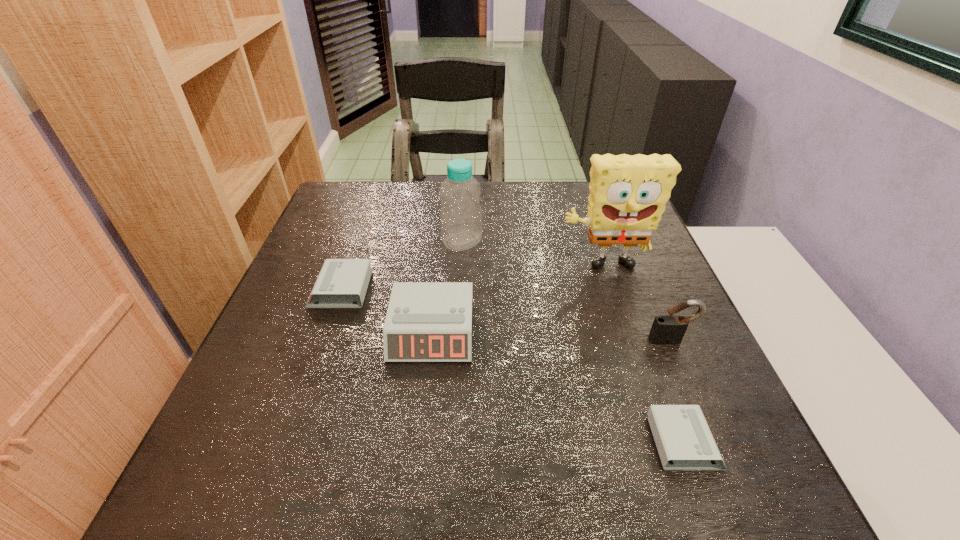
Identify which object is the nearest to the bottle. Please provide its 2D coordinates. Your answer should be formatted as a tuple, i.e. [(x, y)], where the tuple contains the x and y coordinates of a point satisfying the conditions above.

[(341, 282)]

Where is `the second closest alarm clock to the third tallest object`? This screenshot has width=960, height=540. the second closest alarm clock to the third tallest object is located at coordinates (426, 321).

This screenshot has width=960, height=540. I want to click on alarm clock that stands as the closest to the bottle, so click(x=341, y=282).

Where is `free space that satisfies the following two spatial constraints: 1. on the face of the sponge; 2. on the right side of the nearest alarm clock`? This screenshot has height=540, width=960. free space that satisfies the following two spatial constraints: 1. on the face of the sponge; 2. on the right side of the nearest alarm clock is located at coordinates (660, 442).

Find the location of a particular element. The image size is (960, 540). free space that satisfies the following two spatial constraints: 1. on the back side of the bottle; 2. on the left side of the tallest alarm clock is located at coordinates (442, 242).